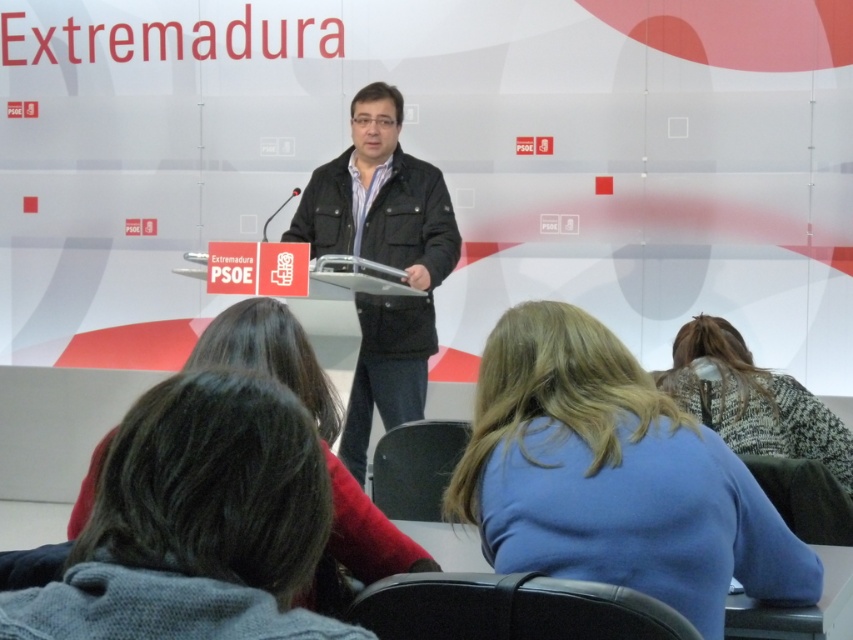
Can you confirm if dark brown leather jacket at center is wider than patterned sweater at center?

Correct, the width of dark brown leather jacket at center exceeds that of patterned sweater at center.

Is dark brown leather jacket at center smaller than patterned sweater at center?

Actually, dark brown leather jacket at center might be larger than patterned sweater at center.

Who is more forward, (407,248) or (763,374)?

Point (763,374) is in front.

Where is `dark brown leather jacket at center`? The height and width of the screenshot is (640, 853). dark brown leather jacket at center is located at coordinates (381, 259).

Who is positioned more to the right, dark brown hair at center or patterned sweater at center?

patterned sweater at center is more to the right.

Image resolution: width=853 pixels, height=640 pixels. I want to click on dark brown hair at center, so [x=320, y=444].

The width and height of the screenshot is (853, 640). Find the location of `dark brown hair at center`. dark brown hair at center is located at coordinates (320, 444).

Between blue fabric shirt at center and dark brown hair at center, which one appears on the left side from the viewer's perspective?

Positioned to the left is dark brown hair at center.

In the scene shown: Is blue fabric shirt at center further to camera compared to dark brown hair at center?

Yes.

Who is more distant from viewer, (793, 568) or (315, 403)?

Positioned behind is point (315, 403).

Locate an element on the screen. The height and width of the screenshot is (640, 853). blue fabric shirt at center is located at coordinates (612, 476).